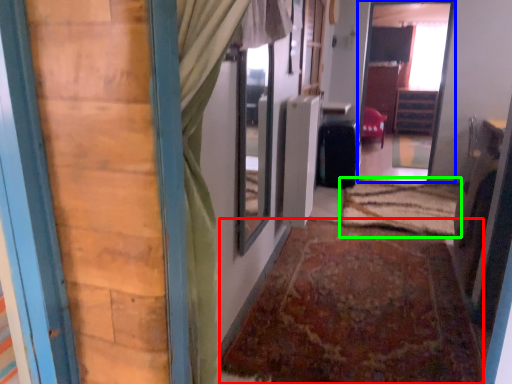
Question: Based on their relative distances, which object is farther from doormat (highlighted by a red box)? Choose from passage (highlighted by a blue box) and doormat (highlighted by a green box).

Choices:
 (A) passage
 (B) doormat

Answer: (A)